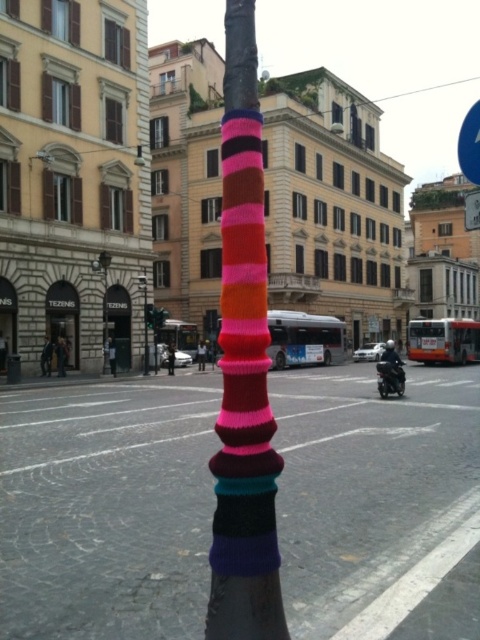
Which is more to the left, knitted yarn pole at center or matte black lamp post at left?

Positioned to the left is matte black lamp post at left.

Between point (240, 214) and point (101, 268), which one is positioned in front?

Point (240, 214) is more forward.

This screenshot has width=480, height=640. Find the location of `knitted yarn pole at center`. knitted yarn pole at center is located at coordinates (243, 369).

Which is more to the right, blue plastic street sign at upper right or shiny black motorcycle at center?

blue plastic street sign at upper right

Who is taller, blue plastic street sign at upper right or shiny black motorcycle at center?

With more height is blue plastic street sign at upper right.

What do you see at coordinates (469, 145) in the screenshot? I see `blue plastic street sign at upper right` at bounding box center [469, 145].

Find the location of a particular element. blue plastic street sign at upper right is located at coordinates (469, 145).

Is point (243, 214) farther from camera compared to point (146, 333)?

No, (243, 214) is in front of (146, 333).

Between knitted yarn pole at center and metallic silver lamp post at center, which one is positioned lower?

Positioned lower is metallic silver lamp post at center.

You are a GUI agent. You are given a task and a screenshot of the screen. Output one action in this format:
    pyautogui.click(x=<x>, y=<y>)
    Task: Click on the knitted yarn pole at center
    Image resolution: width=480 pixels, height=640 pixels.
    Given the screenshot: What is the action you would take?
    pyautogui.click(x=243, y=369)